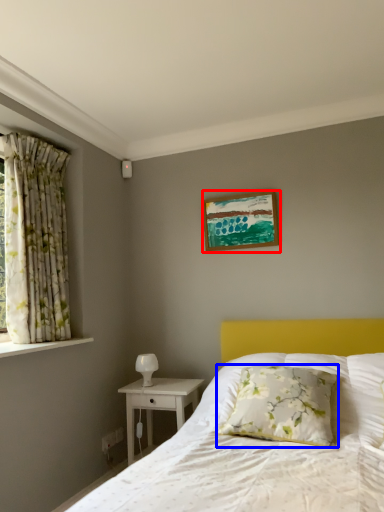
Question: Which object appears closest to the camera in this image, picture frame (highlighted by a red box) or pillow (highlighted by a blue box)?

Choices:
 (A) picture frame
 (B) pillow

Answer: (B)